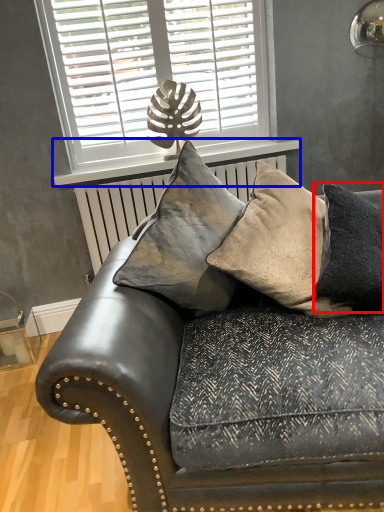
Question: Which of the following is the farthest to the observer, pillow (highlighted by a red box) or window sill (highlighted by a blue box)?

Choices:
 (A) pillow
 (B) window sill

Answer: (B)